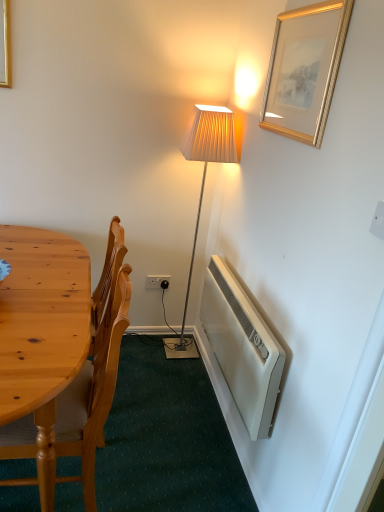
Question: Should I look upward or downward to see wooden chair at left?

Choices:
 (A) down
 (B) up

Answer: (A)

Question: Can you confirm if white plastic power outlet at lower center is shorter than gold/gilded picture frame at upper right?

Choices:
 (A) no
 (B) yes

Answer: (B)

Question: Is white plastic power outlet at lower center looking in the opposite direction of gold/gilded picture frame at upper right?

Choices:
 (A) no
 (B) yes

Answer: (A)

Question: Is white plastic power outlet at lower center positioned in front of gold/gilded picture frame at upper right?

Choices:
 (A) no
 (B) yes

Answer: (A)

Question: Is white plastic power outlet at lower center thinner than gold/gilded picture frame at upper right?

Choices:
 (A) yes
 (B) no

Answer: (B)

Question: Considering the relative sizes of white plastic power outlet at lower center and gold/gilded picture frame at upper right in the image provided, is white plastic power outlet at lower center taller than gold/gilded picture frame at upper right?

Choices:
 (A) no
 (B) yes

Answer: (A)

Question: Does white plastic power outlet at lower center contain gold/gilded picture frame at upper right?

Choices:
 (A) no
 (B) yes

Answer: (A)

Question: From a real-world perspective, is gold/gilded picture frame at upper right under white plastic power outlet at lower center?

Choices:
 (A) yes
 (B) no

Answer: (B)

Question: Is gold/gilded picture frame at upper right at the left side of white plastic power outlet at lower center?

Choices:
 (A) yes
 (B) no

Answer: (B)

Question: Can you confirm if gold/gilded picture frame at upper right is shorter than white plastic power outlet at lower center?

Choices:
 (A) no
 (B) yes

Answer: (A)

Question: Is white plastic power outlet at lower center inside gold/gilded picture frame at upper right?

Choices:
 (A) yes
 (B) no

Answer: (B)

Question: From the image's perspective, would you say gold/gilded picture frame at upper right is positioned over white plastic power outlet at lower center?

Choices:
 (A) no
 (B) yes

Answer: (B)

Question: Is gold/gilded picture frame at upper right with white plastic power outlet at lower center?

Choices:
 (A) yes
 (B) no

Answer: (B)

Question: Does white plastic radiator at lower right lie in front of gold/gilded picture frame at upper right?

Choices:
 (A) no
 (B) yes

Answer: (A)